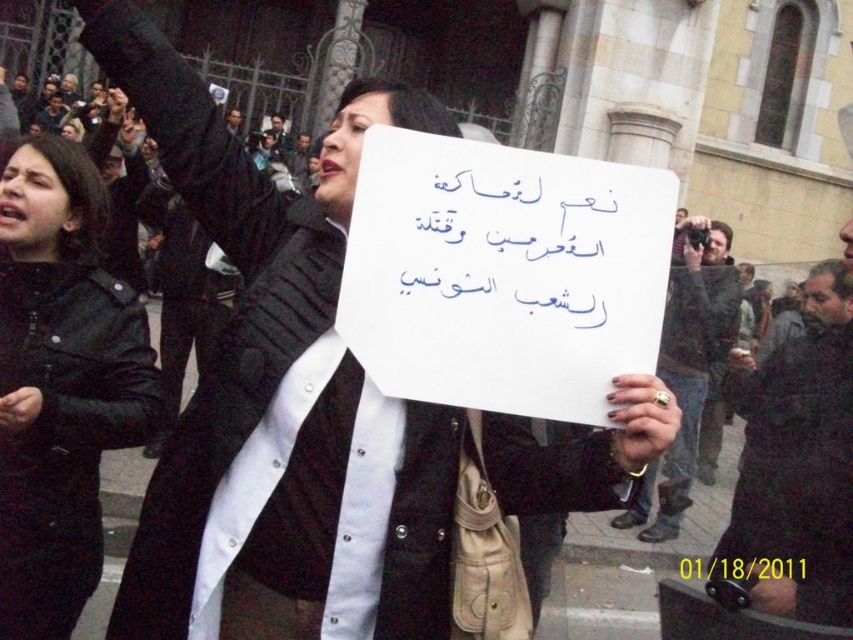
Between black leather jacket at left and black leather robe at center, which one appears on the right side from the viewer's perspective?

black leather robe at center

Is black leather jacket at left positioned at the back of black leather robe at center?

Yes, black leather jacket at left is behind black leather robe at center.

Is point (20, 422) positioned in front of point (672, 451)?

Yes.

Find the location of a particular element. black leather jacket at left is located at coordinates (61, 385).

Is the position of black matte coat at center more distant than that of black leather robe at center?

That is True.

Can you confirm if black matte coat at center is wider than black leather robe at center?

Incorrect, black matte coat at center's width does not surpass black leather robe at center's.

Who is more distant from viewer, (556, 508) or (689, 289)?

The point (689, 289) is more distant.

You are a GUI agent. You are given a task and a screenshot of the screen. Output one action in this format:
    pyautogui.click(x=<x>, y=<y>)
    Task: Click on the black matte coat at center
    Image resolution: width=853 pixels, height=640 pixels.
    Given the screenshot: What is the action you would take?
    235,316

Can you confirm if black matte coat at center is taller than black leather jacket at left?

Correct, black matte coat at center is much taller as black leather jacket at left.

What are the coordinates of `black matte coat at center` in the screenshot? It's located at (235, 316).